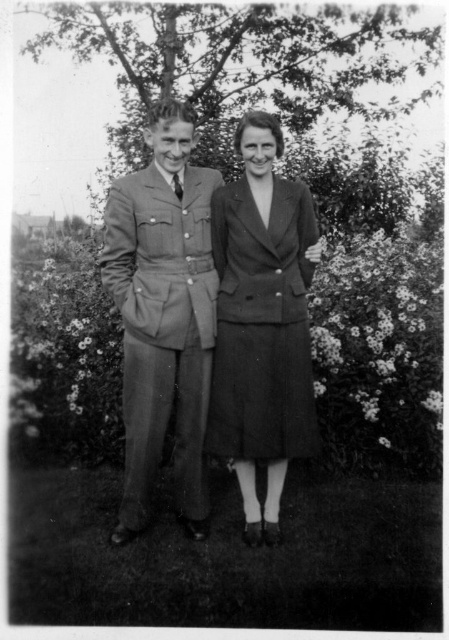
From the picture: Is matte gray suit at center bigger than textured wool dress at center?

Indeed, matte gray suit at center has a larger size compared to textured wool dress at center.

Between matte gray suit at center and textured wool dress at center, which one appears on the left side from the viewer's perspective?

Positioned to the left is matte gray suit at center.

Is point (132, 324) positioned behind point (221, 241)?

That is False.

You are a GUI agent. You are given a task and a screenshot of the screen. Output one action in this format:
    pyautogui.click(x=<x>, y=<y>)
    Task: Click on the matte gray suit at center
    This screenshot has height=640, width=449.
    Given the screenshot: What is the action you would take?
    pyautogui.click(x=163, y=314)

Between gray woolen suit at center and textured wool dress at center, which one has more height?

gray woolen suit at center

Is gray woolen suit at center further to the viewer compared to textured wool dress at center?

No, gray woolen suit at center is closer to the viewer.

Find the location of `gray woolen suit at center`. gray woolen suit at center is located at coordinates (162, 328).

Can you confirm if matte gray suit at center is bigger than gray woolen suit at center?

Yes, matte gray suit at center is bigger than gray woolen suit at center.

Does matte gray suit at center have a lesser height compared to gray woolen suit at center?

Incorrect, matte gray suit at center's height does not fall short of gray woolen suit at center's.

Who is more distant from viewer, (157, 442) or (214, 316)?

Point (214, 316)

The width and height of the screenshot is (449, 640). Find the location of `matte gray suit at center`. matte gray suit at center is located at coordinates (163, 314).